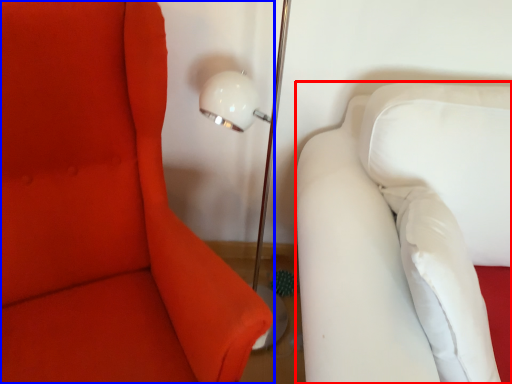
Question: Which of the following is the closest to the observer, furniture (highlighted by a red box) or furniture (highlighted by a blue box)?

Choices:
 (A) furniture
 (B) furniture

Answer: (B)